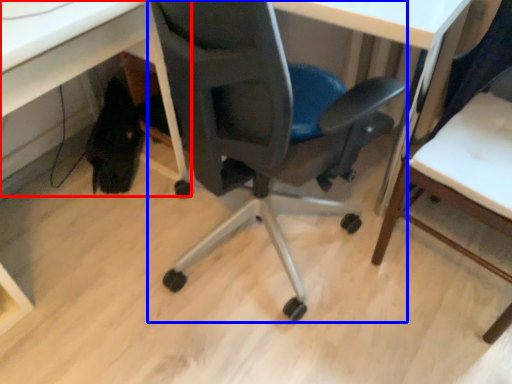
Question: Which object appears farthest to the camera in this image, computer desk (highlighted by a red box) or chair (highlighted by a blue box)?

Choices:
 (A) computer desk
 (B) chair

Answer: (B)